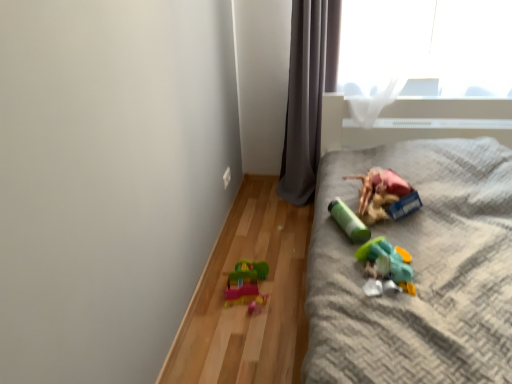
Question: Is matte plastic toy at right, the fourth toy positioned from the left, inside or outside of green matte cylinder at center, acting as the 2th toy starting from the left?

Choices:
 (A) inside
 (B) outside

Answer: (B)

Question: Would you say matte plastic toy at right, the fourth toy positioned from the left, is to the left or to the right of green matte cylinder at center, the 3th toy when ordered from right to left, in the picture?

Choices:
 (A) left
 (B) right

Answer: (B)

Question: Based on their relative distances, which object is nearer to the matte plastic toy at right, the fourth toy positioned from the left?

Choices:
 (A) gray fabric curtain at upper center
 (B) green matte cylinder at center, the 3th toy when ordered from right to left
 (C) translucent plastic toy at lower left, the 1th toy viewed from the left
 (D) plastic toy at right
 (E) translucent plastic toy at lower right, marked as the 2th toy in a right-to-left arrangement

Answer: (B)

Question: Considering the real-world distances, which object is farthest from the plastic toy at right?

Choices:
 (A) matte plastic toy at right, placed as the 1th toy when sorted from right to left
 (B) green matte cylinder at center, acting as the 2th toy starting from the left
 (C) translucent plastic toy at lower right, acting as the 3th toy starting from the left
 (D) translucent plastic toy at lower left, acting as the fourth toy starting from the right
 (E) gray fabric curtain at upper center

Answer: (E)